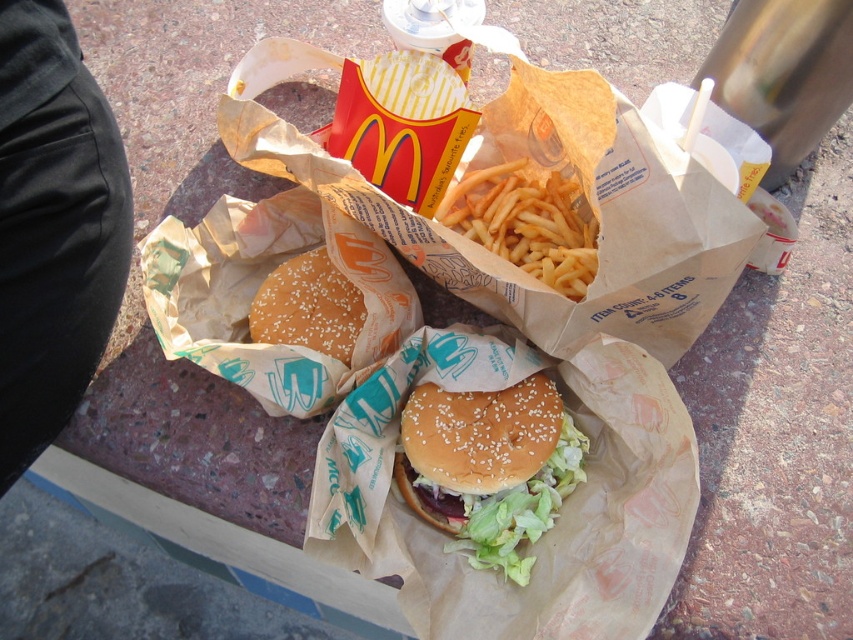
Question: Is semi-glossy sesame seed bun at center bigger than golden crispy french fries at center?

Choices:
 (A) no
 (B) yes

Answer: (A)

Question: Does semi-glossy sesame seed bun at center have a smaller size compared to golden crispy french fries at center?

Choices:
 (A) no
 (B) yes

Answer: (B)

Question: Among these objects, which one is farthest from the camera?

Choices:
 (A) semi-glossy sesame seed bun at center
 (B) golden crispy french fries at center

Answer: (B)

Question: Does semi-glossy sesame seed bun at center appear on the right side of golden crispy french fries at center?

Choices:
 (A) yes
 (B) no

Answer: (B)